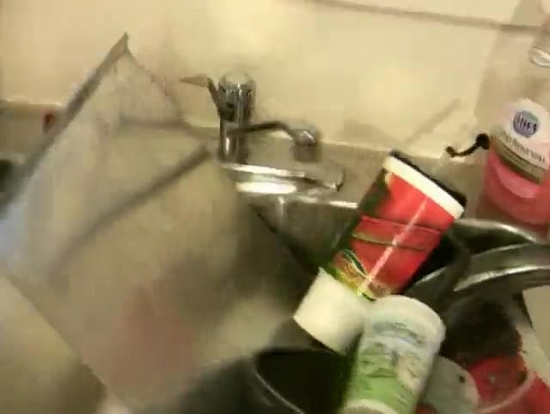
Find the location of a particular element. The image size is (550, 414). red design printed on large cup is located at coordinates (397, 250).